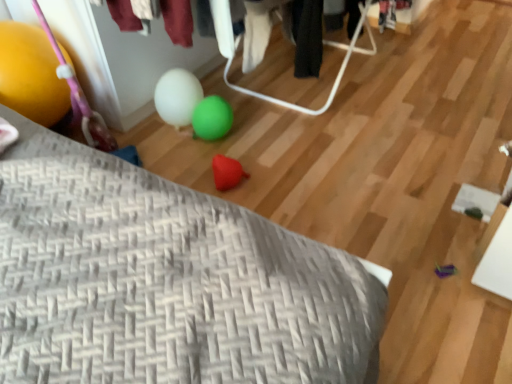
Locate an element on the screen. free space to the back side of rubber heart at center is located at coordinates (237, 151).